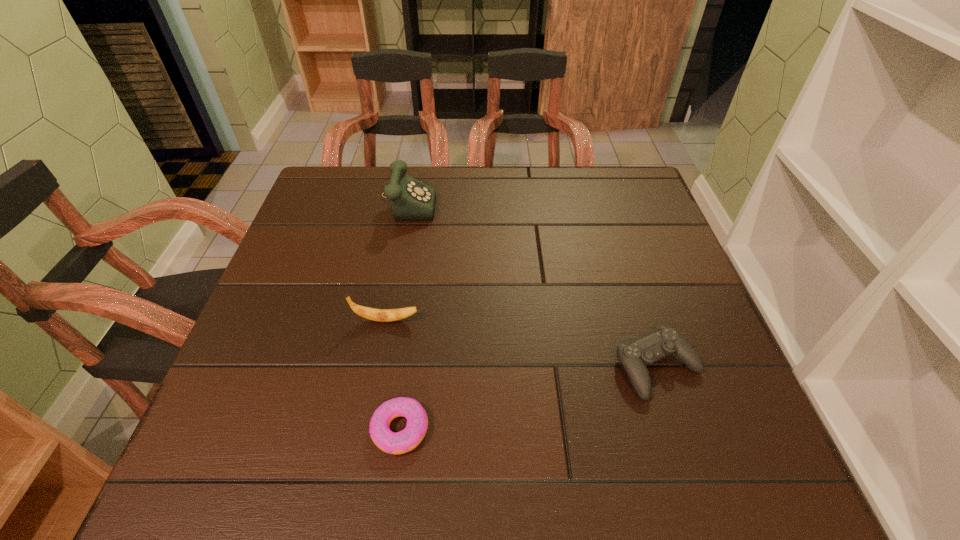
At what (x,y) coordinates should I click in order to perform the action: click on free space that satisfies the following two spatial constraints: 1. on the back side of the nearest object; 2. on the right side of the second nearest object. Please return your answer as a coordinate pair (x, y). The height and width of the screenshot is (540, 960). Looking at the image, I should click on (409, 368).

Locate an element on the screen. Image resolution: width=960 pixels, height=540 pixels. free space that satisfies the following two spatial constraints: 1. on the dial of the farthest object; 2. on the back side of the second nearest object is located at coordinates (377, 368).

Where is `vacant space that satisfies the following two spatial constraints: 1. on the dial of the farthest object; 2. on the right side of the control`? vacant space that satisfies the following two spatial constraints: 1. on the dial of the farthest object; 2. on the right side of the control is located at coordinates pyautogui.click(x=377, y=368).